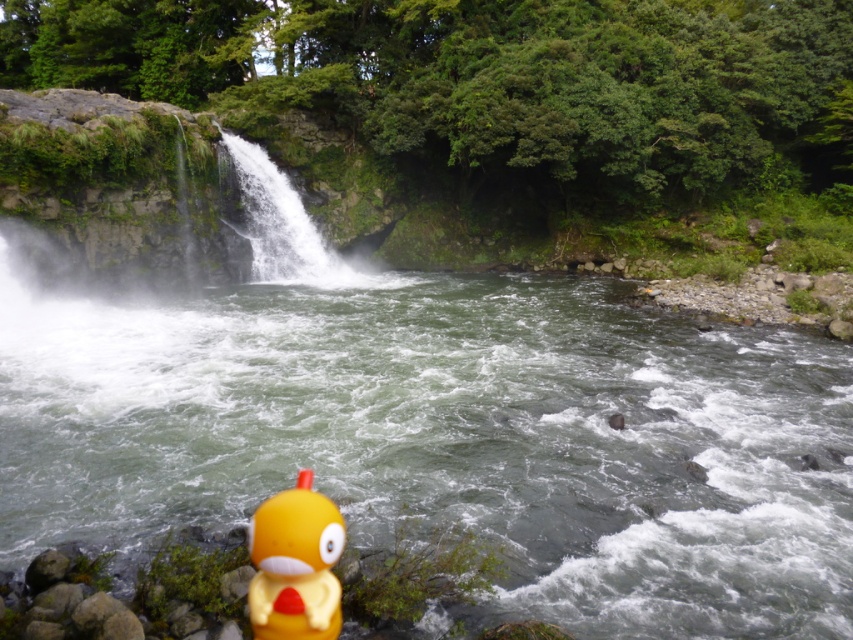
Question: Does yellow rubber duck at lower left appear under white frothy water at center?

Choices:
 (A) no
 (B) yes

Answer: (B)

Question: Does green rubber duck at lower center have a larger size compared to white frothy water at center?

Choices:
 (A) yes
 (B) no

Answer: (A)

Question: Which of the following is the closest to the observer?

Choices:
 (A) (373, 476)
 (B) (305, 497)
 (C) (268, 195)

Answer: (B)

Question: Is yellow rubber duck at lower left to the right of white frothy water at center from the viewer's perspective?

Choices:
 (A) yes
 (B) no

Answer: (A)

Question: Which point is closer to the camera?

Choices:
 (A) green rubber duck at lower center
 (B) yellow rubber duck at lower left

Answer: (B)

Question: Which is farther from the green rubber duck at lower center?

Choices:
 (A) white frothy water at center
 (B) yellow rubber duck at lower left

Answer: (A)